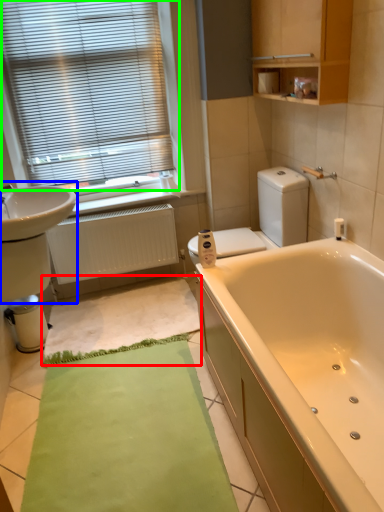
Question: Estimate the real-world distances between objects in this image. Which object is farther from bath mat (highlighted by a red box), sink (highlighted by a blue box) or window blind (highlighted by a green box)?

Choices:
 (A) sink
 (B) window blind

Answer: (B)